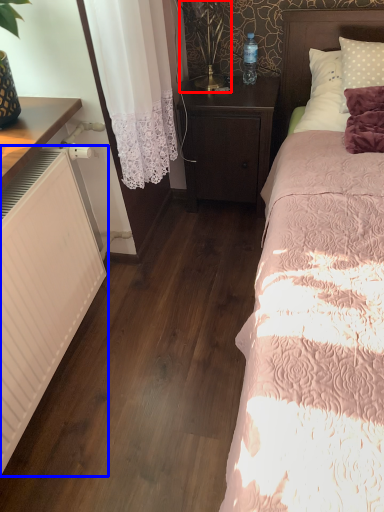
Question: Which object appears closest to the camera in this image, table lamp (highlighted by a red box) or heater (highlighted by a blue box)?

Choices:
 (A) table lamp
 (B) heater

Answer: (B)